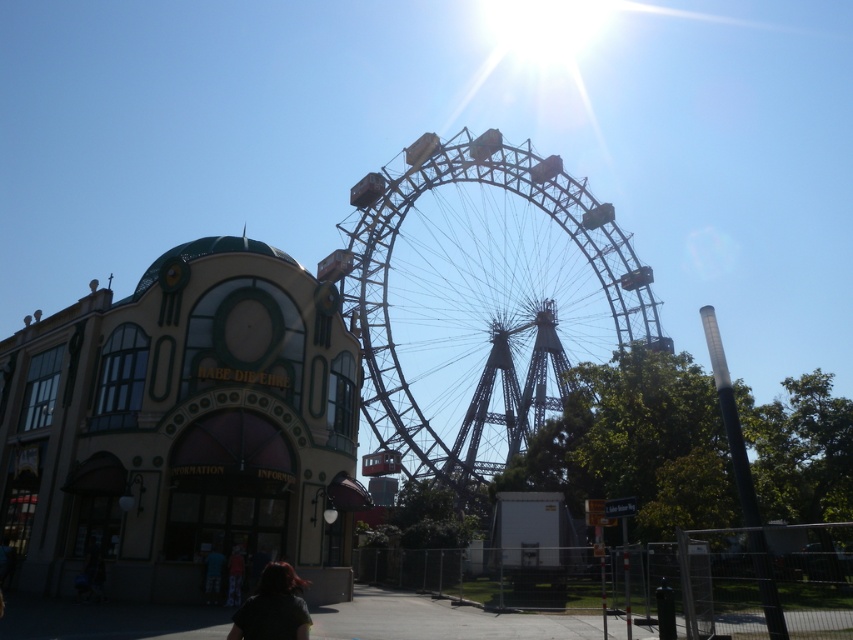
Is metallic gray ferris wheel at center closer to the viewer compared to dark hair at lower center?

No, metallic gray ferris wheel at center is further to the viewer.

Is point (425, 317) positioned before point (302, 582)?

That is False.

Is point (424, 365) more distant than point (260, 627)?

That is True.

The image size is (853, 640). I want to click on metallic gray ferris wheel at center, so click(482, 300).